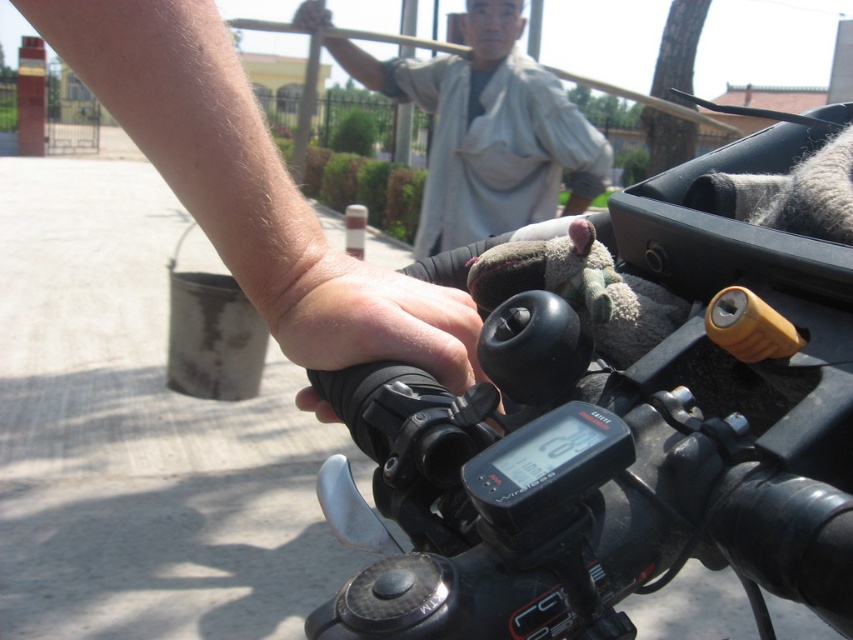
Question: Which point appears closest to the camera in this image?

Choices:
 (A) (729, 301)
 (B) (590, 173)
 (C) (316, 298)
 (D) (154, 122)

Answer: (A)

Question: Considering the relative positions of gray cotton shirt at upper center and dry skin at handle in the image provided, where is gray cotton shirt at upper center located with respect to dry skin at handle?

Choices:
 (A) right
 (B) left

Answer: (B)

Question: In this image, where is smooth skin hand at center located relative to gray cotton shirt at upper center?

Choices:
 (A) above
 (B) below

Answer: (B)

Question: Can you confirm if smooth skin hand at center is positioned below dry skin at handle?

Choices:
 (A) no
 (B) yes

Answer: (A)

Question: Estimate the real-world distances between objects in this image. Which object is farther from the gray cotton shirt at upper center?

Choices:
 (A) black rubber handlebar at center
 (B) dry skin at handle
 (C) smooth skin hand at center

Answer: (B)

Question: Among these objects, which one is farthest from the camera?

Choices:
 (A) smooth skin hand at center
 (B) dry skin at handle
 (C) gray cotton shirt at upper center
 (D) black rubber handlebar at center

Answer: (C)